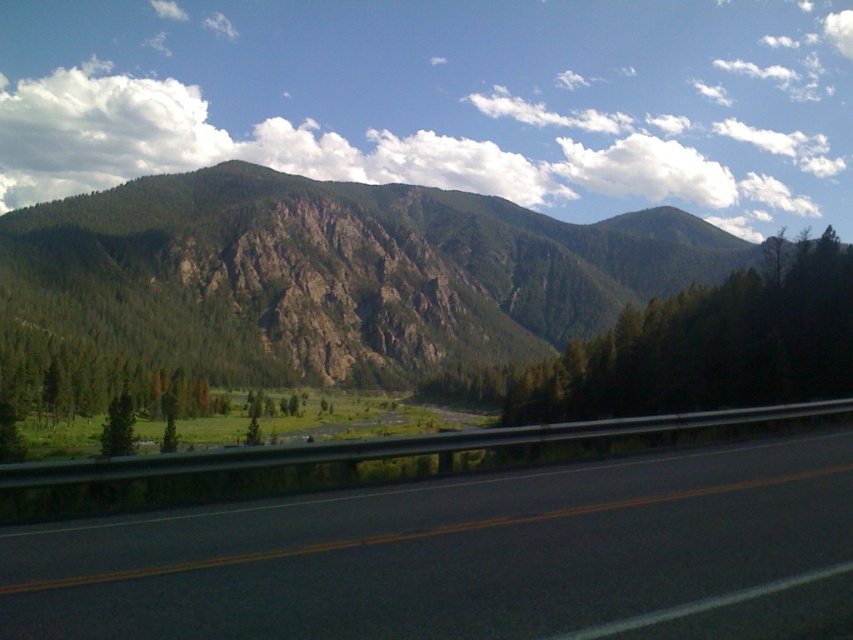
Question: Does black asphalt highway at center lie in front of green rocky mountain at upper left?

Choices:
 (A) yes
 (B) no

Answer: (A)

Question: Observing the image, what is the correct spatial positioning of green rocky mountain at upper left in reference to green matte tree at center?

Choices:
 (A) above
 (B) below

Answer: (A)

Question: Among these points, which one is nearest to the camera?

Choices:
 (A) (659, 582)
 (B) (589, 260)
 (C) (111, 429)

Answer: (A)

Question: Which point appears closest to the camera in this image?

Choices:
 (A) (646, 368)
 (B) (737, 452)

Answer: (B)

Question: Among these objects, which one is nearest to the camera?

Choices:
 (A) green matte tree at lower left
 (B) green rocky mountain at upper left

Answer: (A)

Question: Is black asphalt highway at center thinner than green rocky mountain at upper left?

Choices:
 (A) no
 (B) yes

Answer: (B)